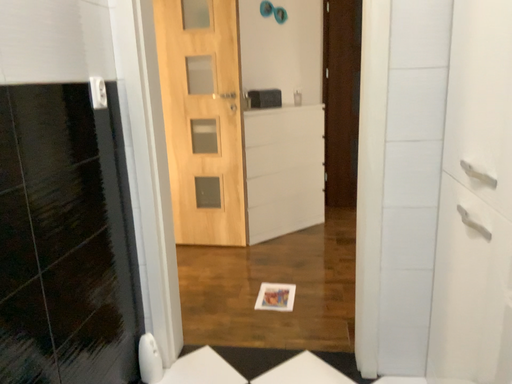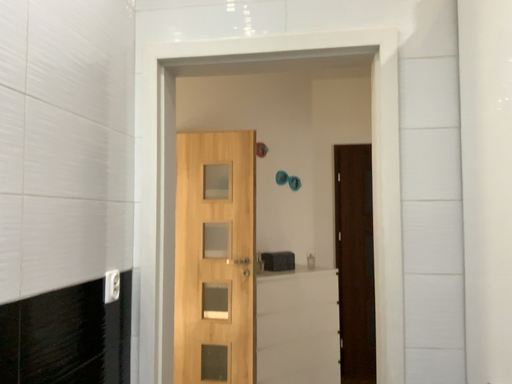
Question: How did the camera likely rotate when shooting the video?

Choices:
 (A) rotated upward
 (B) rotated downward

Answer: (A)